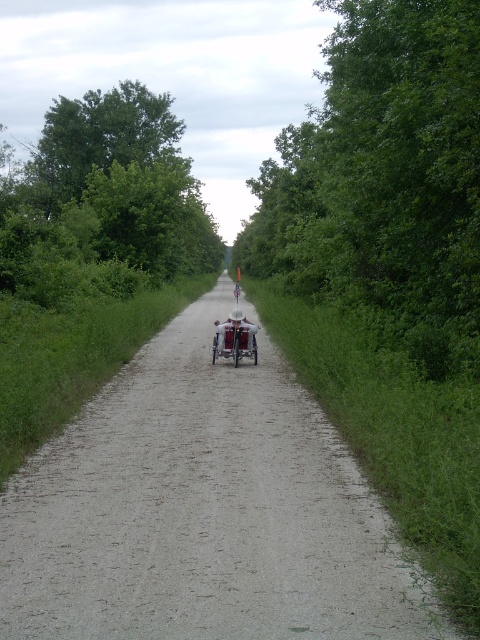
You are a parent pushing a metallic silver baby carriage at center along a gravel path. You notice a green leafy tree at left nearby. Which object is bigger in size?

The green leafy tree at left is larger in size compared to the metallic silver baby carriage at center.

You are standing at the point (406, 323) and want to reach the tricycle in the center of the path. The path is narrow and only allows one person to pass at a time. If the tricycle is moving towards you at 2 feet per second and you start walking towards it at 3 feet per second, how many seconds will it take before you meet?

The distance between you and the tricycle is 47.59 feet. Since you are moving towards each other at a combined speed of 3 feet per second plus 2 feet per second equals 5 feet per second, the time until meeting is 47.59 divided by 5, which is approximately 9.52 seconds.